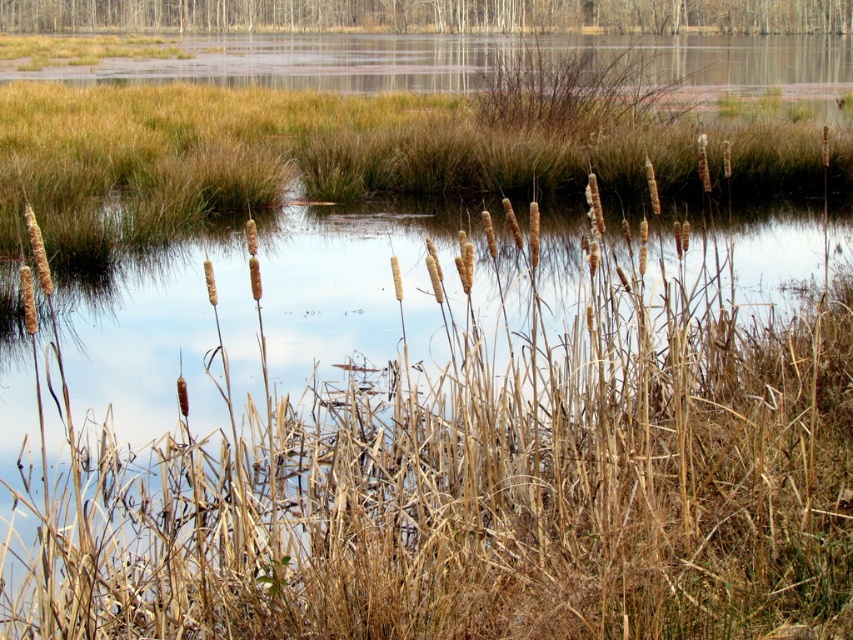
Is dry grass at upper center below brown wood tree at upper center?

Yes.

Between dry grass at upper center and brown wood tree at upper center, which one has more height?

Standing taller between the two is brown wood tree at upper center.

Where is `dry grass at upper center`? Image resolution: width=853 pixels, height=640 pixels. dry grass at upper center is located at coordinates (292, 150).

Does brown dry grass at center have a larger size compared to dry grass at upper center?

Actually, brown dry grass at center might be smaller than dry grass at upper center.

Is brown dry grass at center taller than dry grass at upper center?

Incorrect, brown dry grass at center's height is not larger of dry grass at upper center's.

Between point (721, 296) and point (105, 177), which one is positioned behind?

The point (105, 177) is behind.

Where is `brown dry grass at center`? brown dry grass at center is located at coordinates (451, 444).

Which is below, brown dry grass at center or brown wood tree at upper center?

Positioned lower is brown dry grass at center.

Is point (427, 545) positioned behind point (259, 3)?

No.

Describe the element at coordinates (451, 444) in the screenshot. The width and height of the screenshot is (853, 640). I see `brown dry grass at center` at that location.

The width and height of the screenshot is (853, 640). I want to click on brown dry grass at center, so click(x=451, y=444).